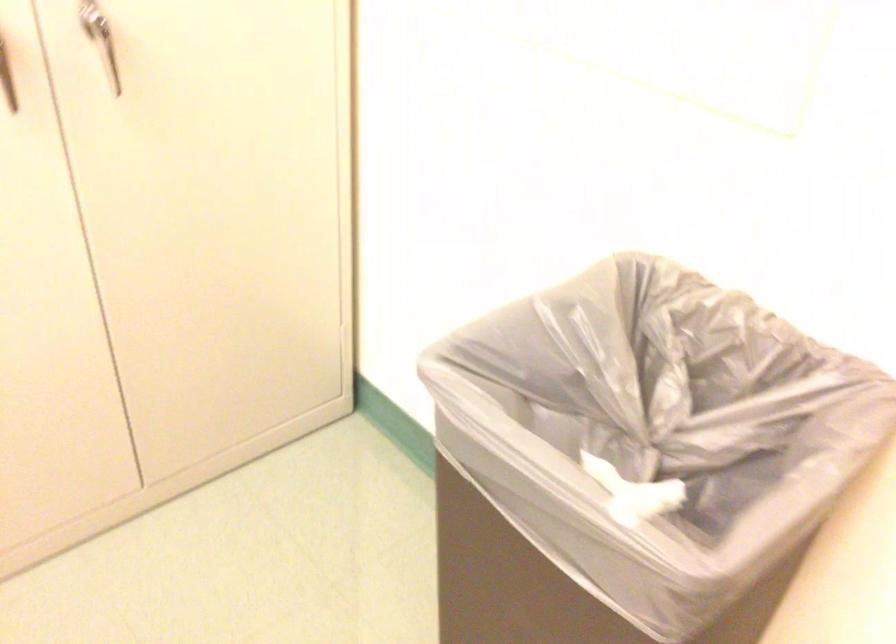
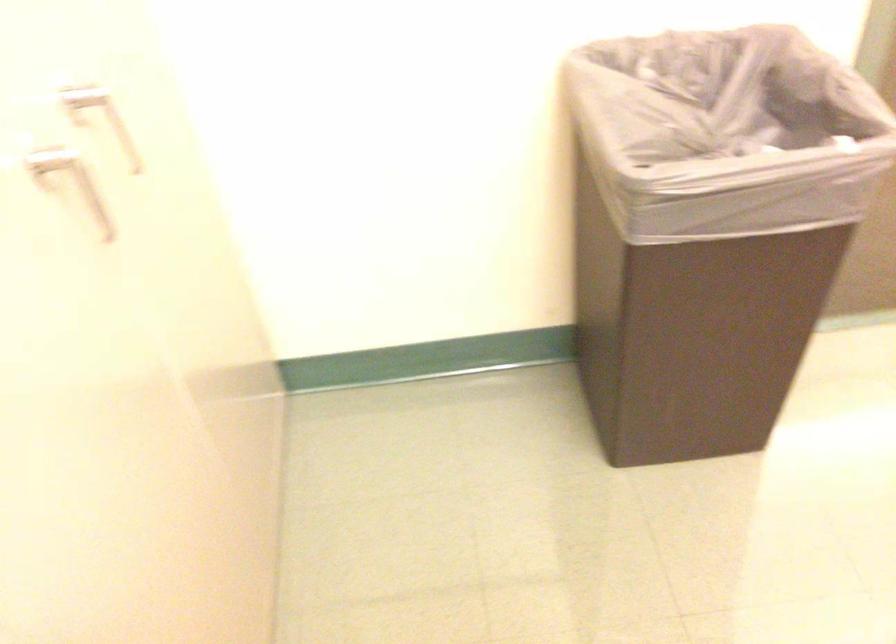
The first image is from the beginning of the video and the second image is from the end. How did the camera likely rotate when shooting the video?

The rotation direction of the camera is right-down.